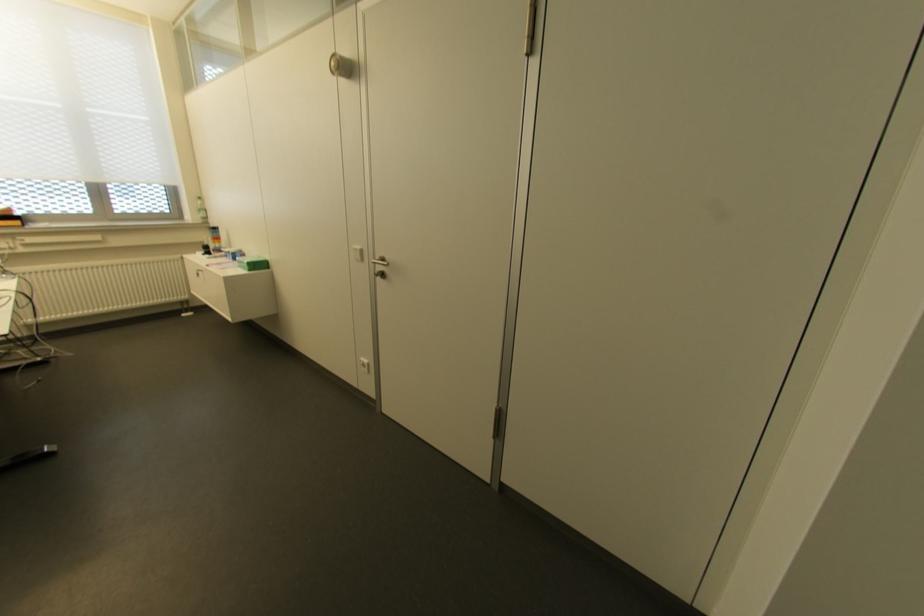
Find where to turn the metal door handle. Please return your answer as a coordinate pair (x, y).

(380, 267)